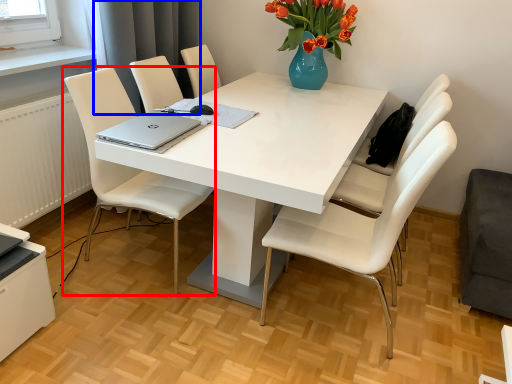
Question: Which object appears farthest to the camera in this image, chair (highlighted by a red box) or curtain (highlighted by a blue box)?

Choices:
 (A) chair
 (B) curtain

Answer: (B)